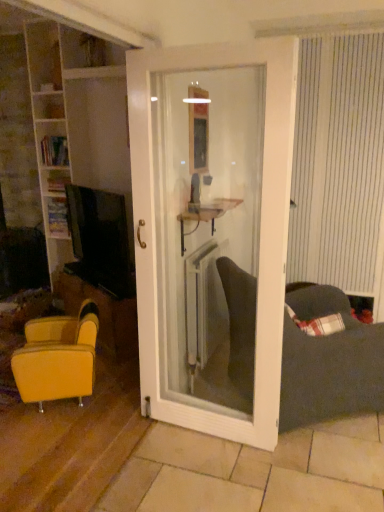
Question: Based on their positions, is white wooden door at center located to the left or right of yellow leather chair at left, marked as the second table in a right-to-left arrangement?

Choices:
 (A) left
 (B) right

Answer: (B)

Question: Is white wooden door at center bigger or smaller than yellow leather chair at left, which is the 1th table in bottom-to-top order?

Choices:
 (A) big
 (B) small

Answer: (A)

Question: Considering the real-world distances, which object is closest to the wooden bookshelf at left?

Choices:
 (A) white wood bookshelf at left
 (B) yellow leather chair at left, which is the first table in left-to-right order
 (C) leather-like yellow armchair at lower left
 (D) white striped curtain at right
 (E) white wooden door at center

Answer: (A)

Question: Which object is positioned farthest from the matte white shelf at center, acting as the 1th table starting from the front?

Choices:
 (A) white wooden door at center
 (B) white striped curtain at right
 (C) white metallic radiator at center
 (D) leather-like yellow armchair at lower left
 (E) wooden bookshelf at left

Answer: (E)